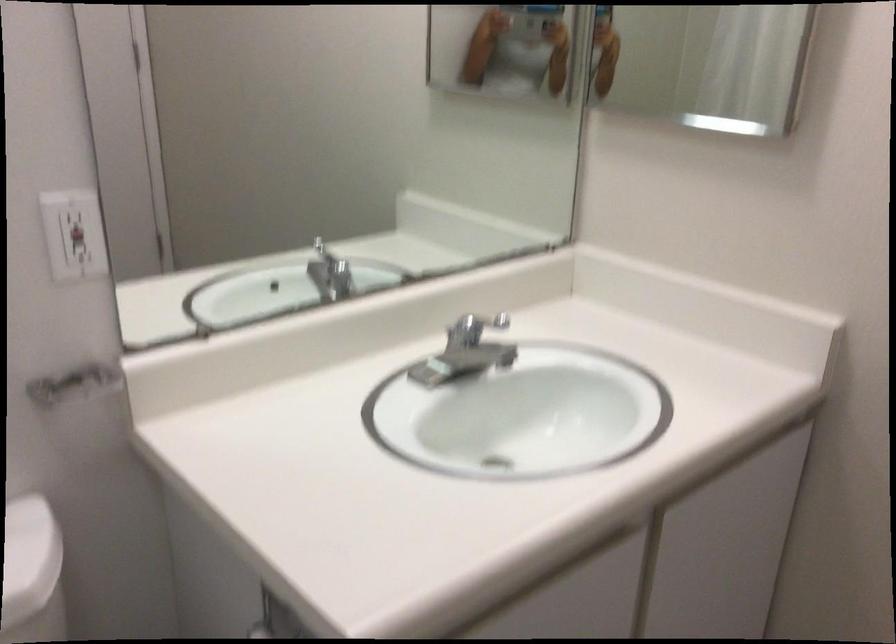
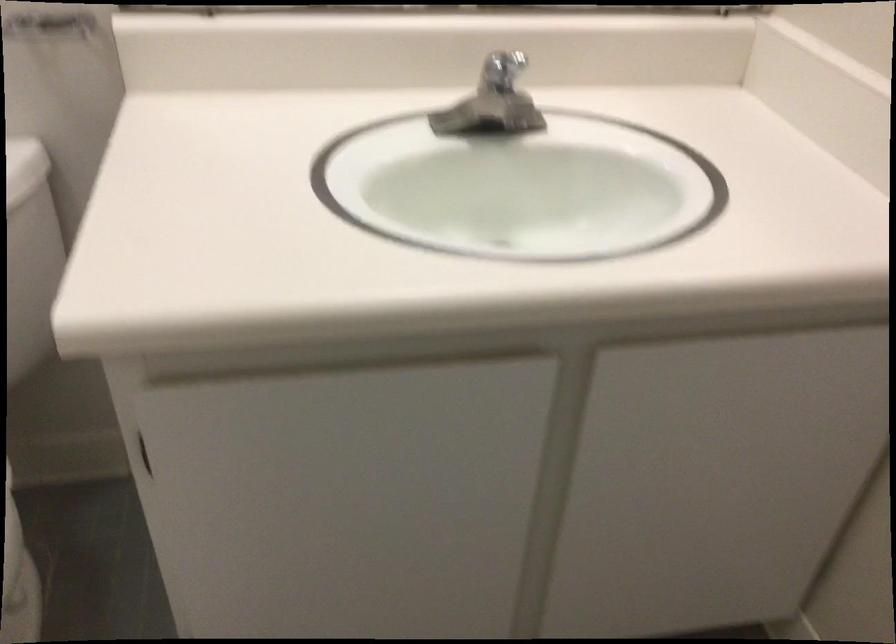
In the second image, find the point that corresponds to (x=471, y=324) in the first image.

(503, 70)